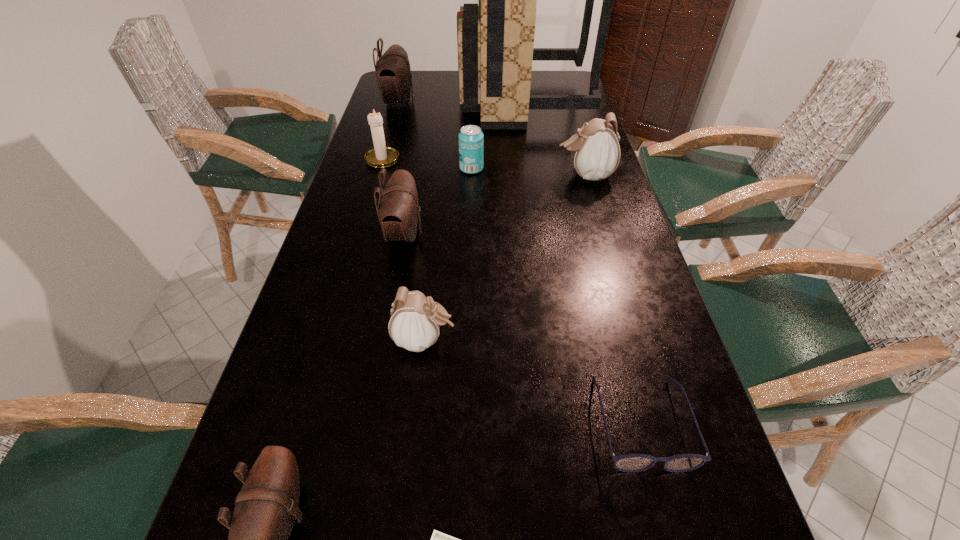
Identify the location of spectacles at the right edge. This screenshot has height=540, width=960. (631, 463).

You are a GUI agent. You are given a task and a screenshot of the screen. Output one action in this format:
    pyautogui.click(x=<x>, y=<y>)
    Task: Click on the object that is at the far left corner
    
    Given the screenshot: What is the action you would take?
    tap(393, 73)

Where is `object present at the far right corner`? This screenshot has width=960, height=540. object present at the far right corner is located at coordinates (495, 40).

Identify the location of vacant region at the left edge of the desktop. The height and width of the screenshot is (540, 960). (367, 176).

This screenshot has width=960, height=540. I want to click on vacant area at the right edge of the desktop, so click(x=601, y=393).

This screenshot has height=540, width=960. I want to click on free spot between the spectacles and the farthest pouch, so click(x=519, y=262).

You are a GUI agent. You are given a task and a screenshot of the screen. Output one action in this format:
    pyautogui.click(x=<x>, y=<y>)
    Task: Click on the free space that is in between the white candle holder and the farthest pouch
    
    Given the screenshot: What is the action you would take?
    pyautogui.click(x=391, y=130)

This screenshot has height=540, width=960. I want to click on free space that is in between the second biggest brown pouch and the second nearest pouch, so click(415, 287).

Find the location of `empty location between the farthest pouch and the right white pouch`. empty location between the farthest pouch and the right white pouch is located at coordinates tap(492, 139).

The width and height of the screenshot is (960, 540). Find the location of `vacant area between the fourth farthest pouch and the white candle holder`. vacant area between the fourth farthest pouch and the white candle holder is located at coordinates (404, 249).